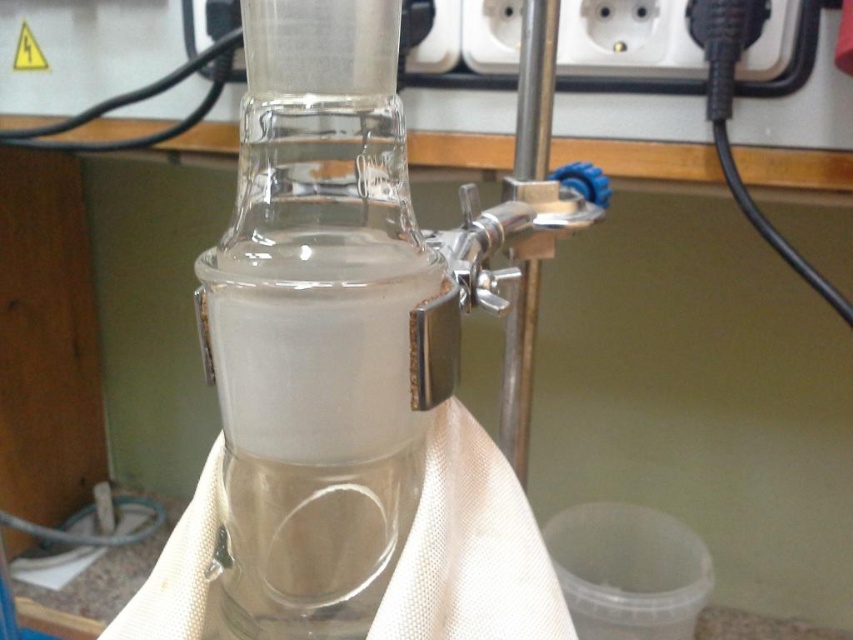
You are a lab technician needing to place a small tool into the transparent glass blender at center. The white plastic socket at upper center is nearby. Which object should you use to hold the tool while inserting it into the blender?

The white plastic socket at upper center should be used to hold the tool since it is larger than the transparent glass blender at center, providing a more stable and secure grip for the tool during insertion.

You are an assistant in the laboratory and need to adjust the clamp holding the conical flask. You notice two points marked on the setup, point A at coordinates point [318,593] and point B at coordinates point [666,29]. Which point is closer to you when you are facing the laboratory setup?

Point point [318,593] is closer to the viewer than point point [666,29].